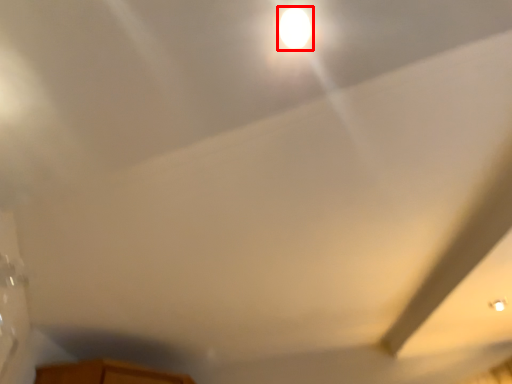
Question: From the image's perspective, considering the relative positions of light (annotated by the red box) and exhaust hood in the image provided, where is light (annotated by the red box) located with respect to the staircase?

Choices:
 (A) above
 (B) below

Answer: (A)